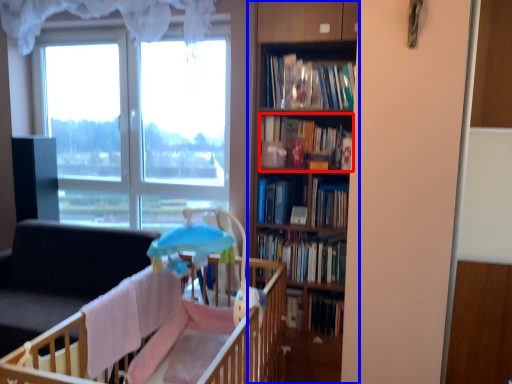
Question: Which object is further to the camera taking this photo, book (highlighted by a red box) or bookcase (highlighted by a blue box)?

Choices:
 (A) book
 (B) bookcase

Answer: (A)